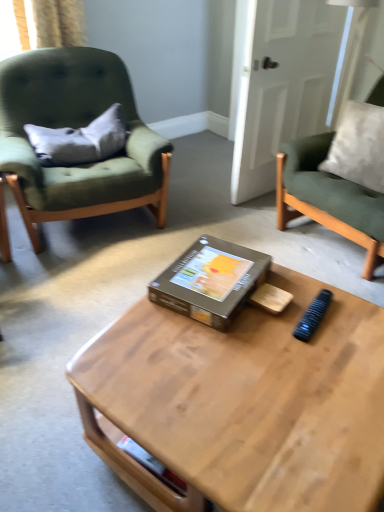
The width and height of the screenshot is (384, 512). What are the coordinates of `free area in between black plastic remote control at center and brown cardboard box at center` in the screenshot? It's located at (282, 308).